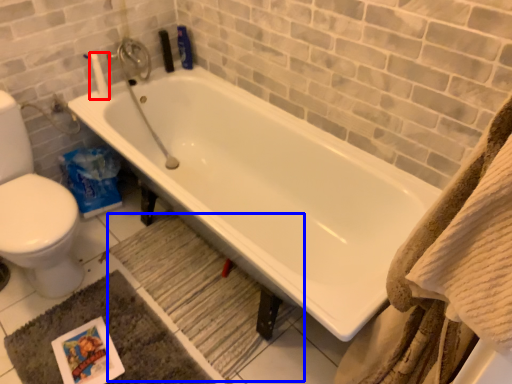
Question: Which object is further to the camera taking this photo, toilet paper (highlighted by a red box) or bath mat (highlighted by a blue box)?

Choices:
 (A) toilet paper
 (B) bath mat

Answer: (A)